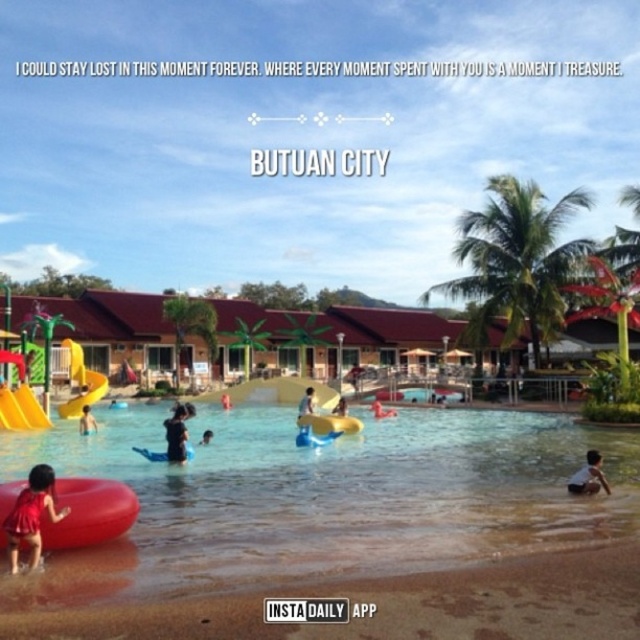
You are a lifeguard standing at the edge of the shallow pool. You notice a child wearing the matte red swimsuit at lower left and a yellow plastic slide at lower left. If the child wants to reach the slide, will they have to walk more than 10 meters?

The distance between the matte red swimsuit at lower left and the yellow plastic slide at lower left is 13.94 meters, so yes, the child will have to walk more than 10 meters to reach the slide.

You are a photographer at the water park and want to capture both the matte red swimsuit at lower left and the yellow plastic slide at lower left in a single shot. Based on their sizes, which object will appear bigger in the photo?

The matte red swimsuit at lower left will appear bigger in the photo because it is larger in size than the yellow plastic slide at lower left.